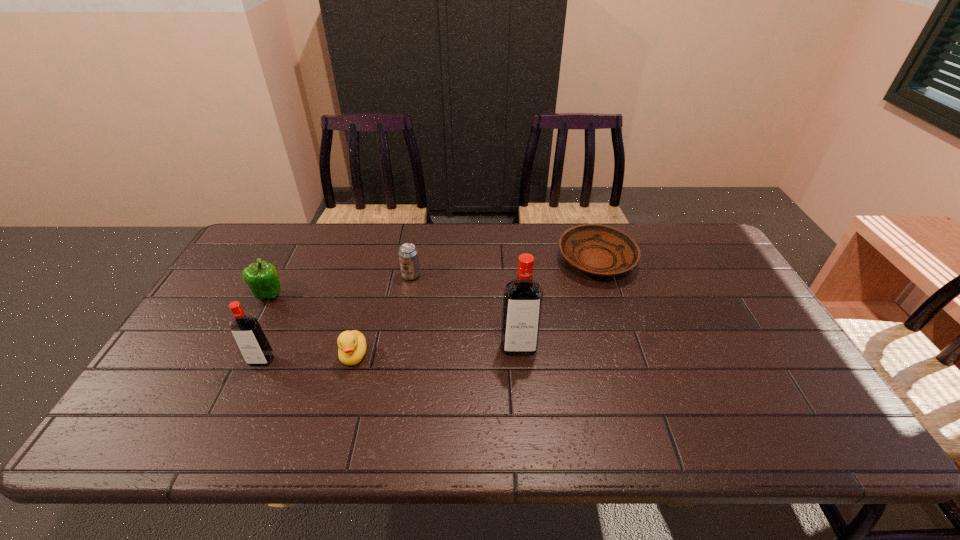
Where is `vacant space that's between the fourth shortest object and the second shortest object`? vacant space that's between the fourth shortest object and the second shortest object is located at coordinates (311, 325).

This screenshot has height=540, width=960. I want to click on vacant point located between the fourth shortest object and the fifth object from left to right, so click(x=394, y=321).

Locate an element on the screen. object identified as the closest to the fourth object from right to left is located at coordinates (251, 340).

This screenshot has height=540, width=960. In order to click on object identified as the fifth closest to the third tallest object in this screenshot , I will do `click(599, 250)`.

Identify the location of vacant region that satisfies the following two spatial constraints: 1. on the back side of the bell pepper; 2. on the left side of the rightmost object. The image size is (960, 540). (287, 261).